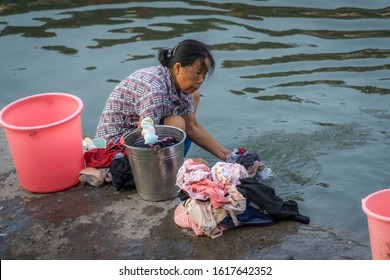
I want to click on bucket, so (45, 140), (380, 210).